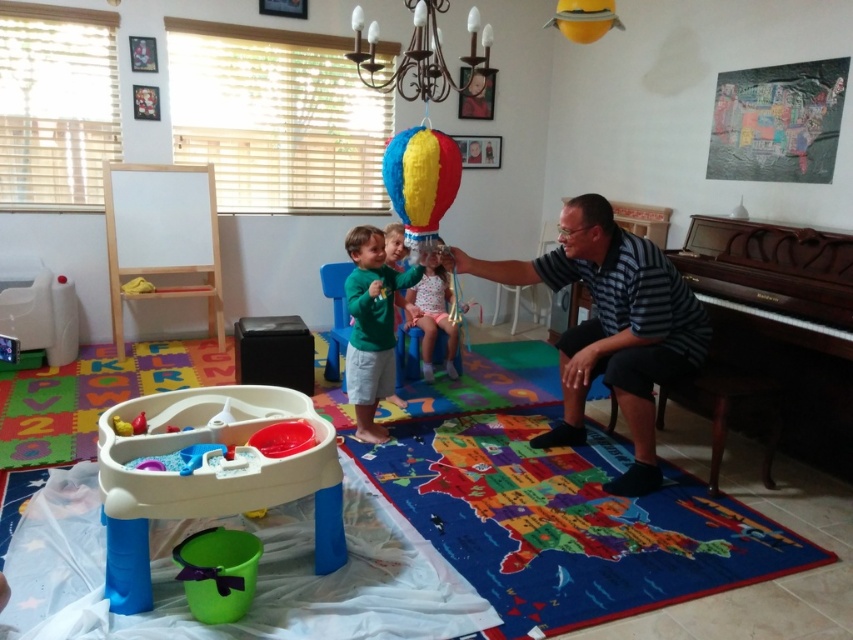
Question: Which object is farther from the camera taking this photo?

Choices:
 (A) blue plastic chair at center
 (B) brown polished wood piano at right

Answer: (A)

Question: Does blue plastic chair at center appear under green plastic chair at center?

Choices:
 (A) yes
 (B) no

Answer: (B)

Question: Among these objects, which one is farthest from the camera?

Choices:
 (A) multicolored paper balloon at center
 (B) matte pink dress at center
 (C) white plastic chair at right

Answer: (C)

Question: Can you confirm if brown polished wood piano at right is positioned below green matte shirt at center?

Choices:
 (A) no
 (B) yes

Answer: (A)

Question: Can you confirm if white plastic water table at lower left is positioned below metallic chandelier at upper center?

Choices:
 (A) yes
 (B) no

Answer: (A)

Question: Which point appears closest to the camera in this image?

Choices:
 (A) (412, 316)
 (B) (328, 348)
 (C) (390, 280)
 (D) (834, 346)

Answer: (D)